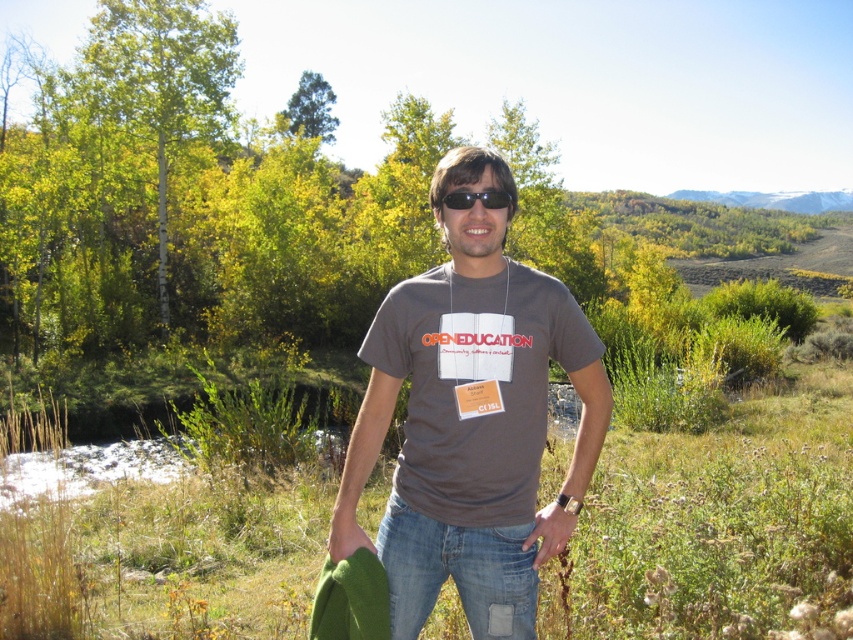
Question: Is brown cotton t-shirt at center wider than black plastic sunglasses at center?

Choices:
 (A) no
 (B) yes

Answer: (B)

Question: Can you confirm if brown cotton t-shirt at center is bigger than black plastic sunglasses at center?

Choices:
 (A) no
 (B) yes

Answer: (B)

Question: Which of the following is the farthest from the observer?

Choices:
 (A) brown cotton t-shirt at center
 (B) black plastic sunglasses at center

Answer: (A)

Question: Does brown cotton t-shirt at center have a larger size compared to black plastic sunglasses at center?

Choices:
 (A) yes
 (B) no

Answer: (A)

Question: Which point is farther to the camera?

Choices:
 (A) black plastic sunglasses at center
 (B) brown cotton t-shirt at center

Answer: (B)